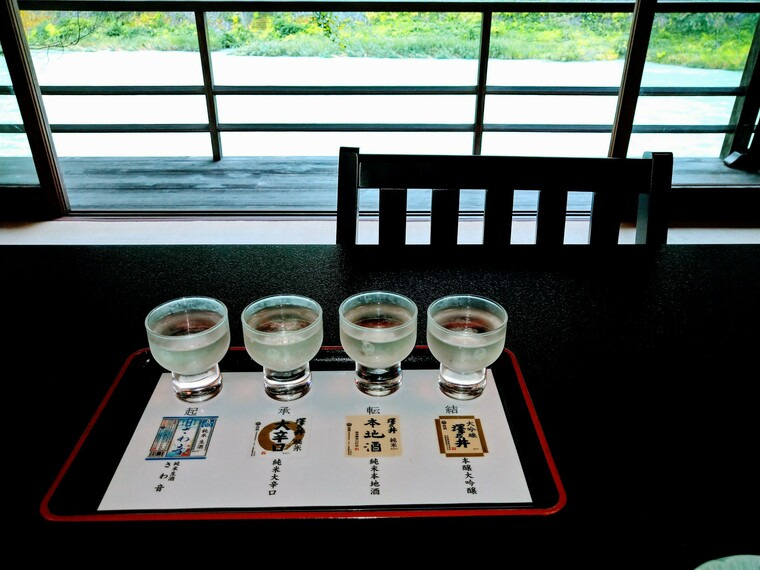
I want to click on cups, so [201, 358], [280, 354], [369, 348], [458, 353].